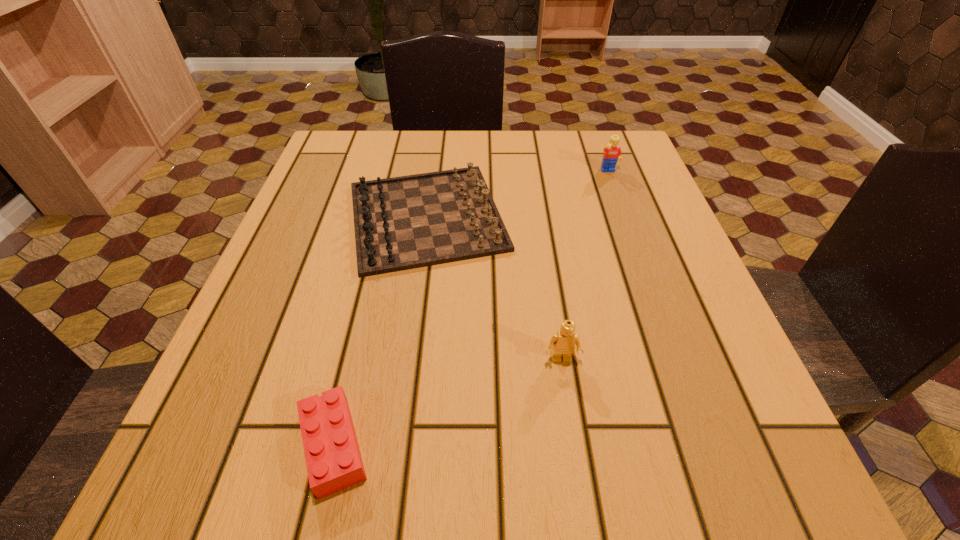
Find the location of `the rightmost object`. the rightmost object is located at coordinates (612, 152).

Find the location of a particular element. The width and height of the screenshot is (960, 540). the farthest Lego is located at coordinates (612, 152).

Image resolution: width=960 pixels, height=540 pixels. In order to click on the second farthest Lego in this screenshot , I will do pyautogui.click(x=562, y=343).

At what (x,y) coordinates should I click in order to perform the action: click on the third object from left to right. Please return your answer as a coordinate pair (x, y). This screenshot has width=960, height=540. Looking at the image, I should click on (562, 343).

At what (x,y) coordinates should I click in order to perform the action: click on chessboard. Please return your answer as a coordinate pair (x, y). The width and height of the screenshot is (960, 540). Looking at the image, I should click on (407, 222).

Where is `the shortest Lego`? This screenshot has width=960, height=540. the shortest Lego is located at coordinates (333, 459).

You are a GUI agent. You are given a task and a screenshot of the screen. Output one action in this format:
    pyautogui.click(x=<x>, y=<y>)
    Task: Click on the nearest Lego
    The image size is (960, 540).
    Given the screenshot: What is the action you would take?
    pyautogui.click(x=333, y=459)

Find the location of a particular element. free space located 0.140m on the face of the rightmost Lego is located at coordinates (624, 214).

Image resolution: width=960 pixels, height=540 pixels. Find the location of `free space located 0.070m on the face of the second farthest Lego`. free space located 0.070m on the face of the second farthest Lego is located at coordinates (569, 411).

Locate an element on the screen. The height and width of the screenshot is (540, 960). free space located 0.100m on the left of the chessboard is located at coordinates (293, 217).